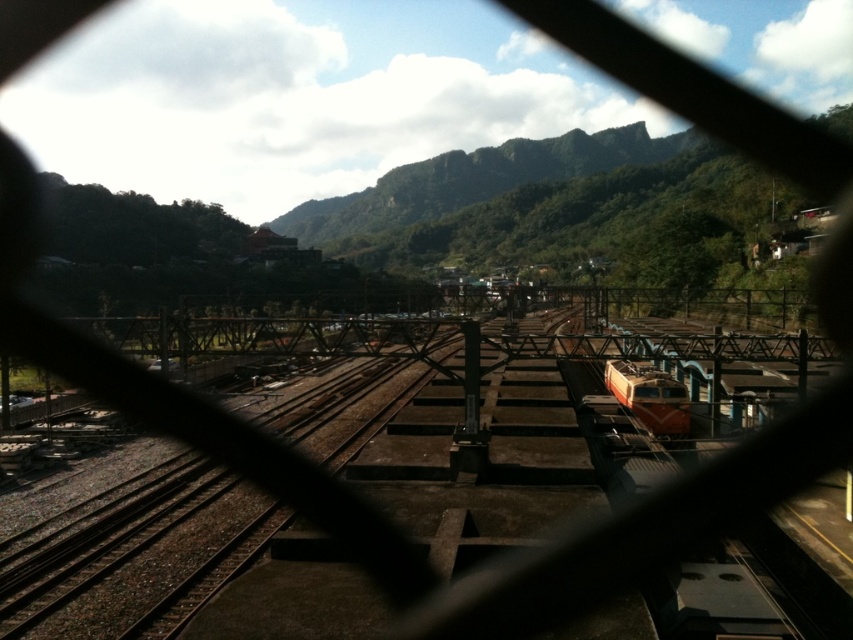
Question: Is rusty metal train track at center to the right of orange metallic train at center from the viewer's perspective?

Choices:
 (A) no
 (B) yes

Answer: (A)

Question: Can you confirm if rusty metal train track at center is smaller than orange metallic train at center?

Choices:
 (A) yes
 (B) no

Answer: (B)

Question: Can you confirm if rusty metal train track at center is positioned above orange metallic train at center?

Choices:
 (A) yes
 (B) no

Answer: (B)

Question: Among these objects, which one is nearest to the camera?

Choices:
 (A) rusty metal train track at center
 (B) orange metallic train at center

Answer: (A)

Question: Among these objects, which one is nearest to the camera?

Choices:
 (A) orange metallic train at center
 (B) rusty metal train track at center

Answer: (B)

Question: Which of the following is the closest to the observer?

Choices:
 (A) (682, 396)
 (B) (138, 371)

Answer: (B)